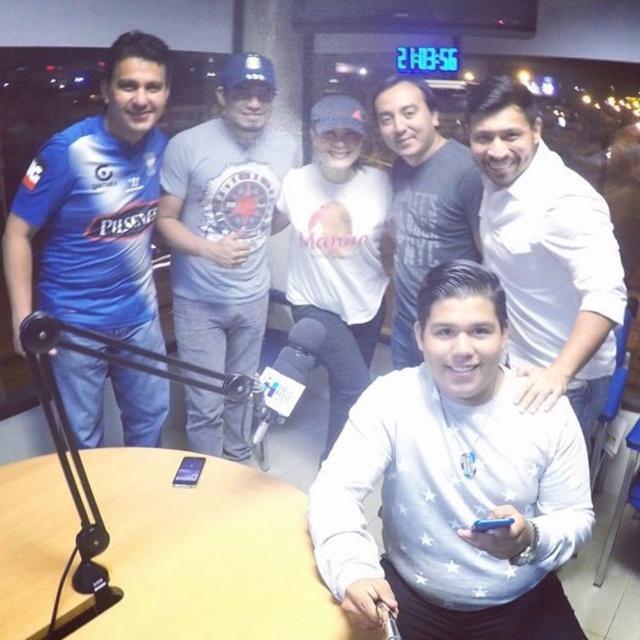
Question: Does white matte sweatshirt at center come in front of white matte shirt at center?

Choices:
 (A) no
 (B) yes

Answer: (B)

Question: Which point is farther from the camera taking this photo?

Choices:
 (A) (392, 611)
 (B) (109, 476)

Answer: (B)

Question: Observing the image, what is the correct spatial positioning of white matte sweatshirt at center in reference to matte blue jersey at left?

Choices:
 (A) above
 (B) below

Answer: (B)

Question: Can you confirm if matte blue jersey at left is wider than gray cotton t-shirt at center?

Choices:
 (A) yes
 (B) no

Answer: (A)

Question: Based on their relative distances, which object is nearer to the wooden table at center?

Choices:
 (A) white glossy shirt at upper right
 (B) white matte shirt at center
 (C) white matte sweatshirt at center
 (D) matte blue jersey at left

Answer: (C)

Question: Which point is closer to the camera?

Choices:
 (A) white matte shirt at center
 (B) white matte sweatshirt at center
 (C) matte blue jersey at left
 (D) wooden table at center

Answer: (B)